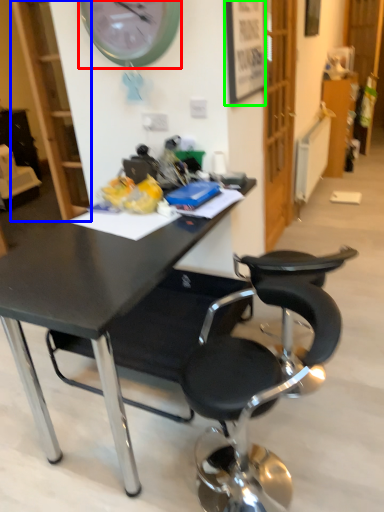
Question: Which object is positioned farthest from wall clock (highlighted by a red box)? Select from bookshelf (highlighted by a blue box) and picture frame (highlighted by a green box).

Choices:
 (A) bookshelf
 (B) picture frame

Answer: (A)